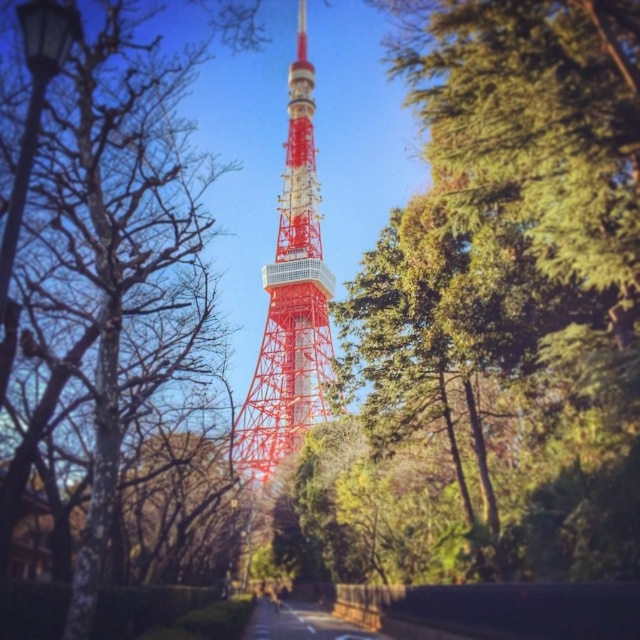
Which is above, red painted metal tower at center or bare wood tree at left?

red painted metal tower at center is above.

From the picture: Does red painted metal tower at center appear under bare wood tree at left?

No, red painted metal tower at center is not below bare wood tree at left.

Is point (320, 381) positioned after point (115, 310)?

That is True.

I want to click on red painted metal tower at center, so click(x=291, y=301).